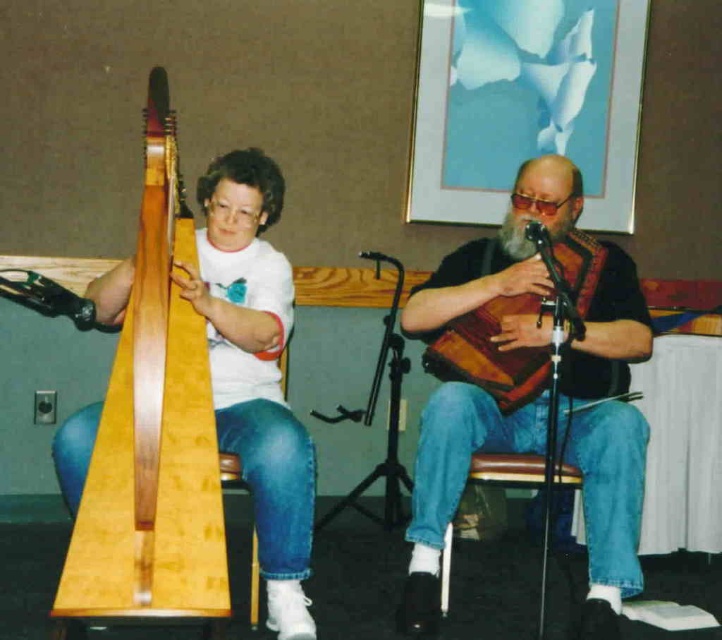
You are a stagehand setting up for a music performance. You need to place the light brown wood harp at left and the wooden textured bagpipe at center on a stage that can only accommodate one large instrument. Which instrument should you choose to place on the stage?

The light brown wood harp at left is larger in size than the wooden textured bagpipe at center, so you should choose the light brown wood harp at left to place on the stage since it requires more space.

You are a photographer setting up for a photo shoot. You need to position a camera tripod so that both the light brown wood harp at left and the brown wood stool at lower center are in the frame. Considering their heights, which object should be placed closer to the camera to ensure both are fully visible in the photo?

The light brown wood harp at left is much taller than the brown wood stool at lower center. To ensure both are fully visible, the taller harp should be placed closer to the camera so that the photographer can capture its full height without the stool blocking the view.